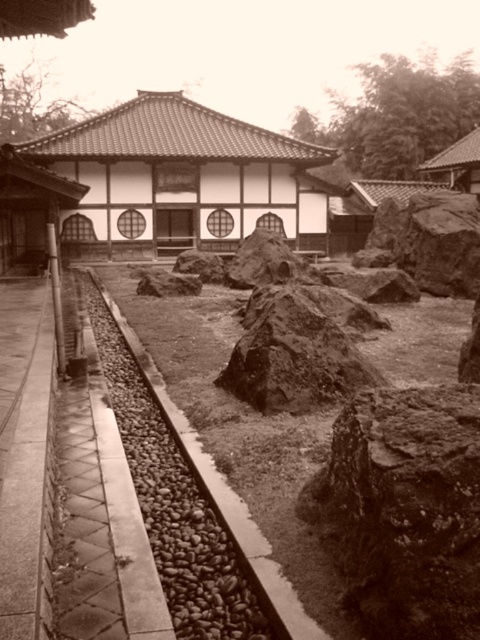
You are a small toy train that is 2 inches tall. You are on the smooth stone train track at center and want to move to the rustic brown rock at center. Can you climb over the height difference between them?

The smooth stone train track at center has a greater height compared to rustic brown rock at center. Since the train is 2 inches tall, it may have difficulty climbing over the height difference between them as the track is higher than the rock.

You are a gardener who wants to place a new decorative item between the rusty rock at center and the smooth stone train track at center. The item is 2 feet long. Will there be enough space between them to place it without moving either object?

The rusty rock at center is 3.80 feet away from the smooth stone train track at center. Since the item is 2 feet long, there is sufficient space between them to place it without moving either object.